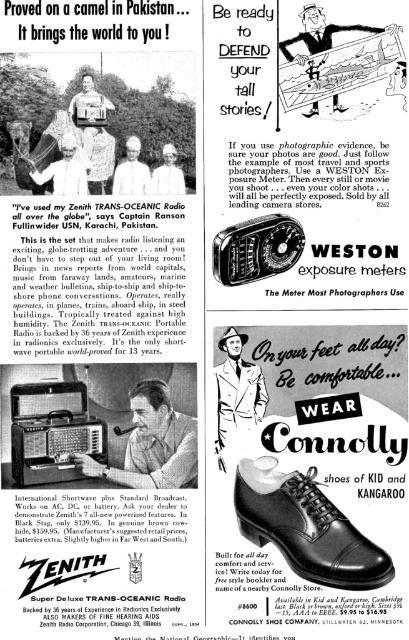
Does matte black radio at upper left have a greater width compared to white matte uniform at center?

Yes.

Who is positioned more to the right, matte black radio at upper left or white matte uniform at center?

white matte uniform at center is more to the right.

Does point (83, 188) come farther from viewer compared to point (175, 168)?

Yes, it is behind point (175, 168).

In order to click on matte black radio at upper left in this screenshot , I will do `click(65, 170)`.

Is the position of matte black suit at upper center less distant than that of white matte hat at center?

Yes.

Can you confirm if matte black suit at upper center is wider than white matte hat at center?

Indeed, matte black suit at upper center has a greater width compared to white matte hat at center.

Does point (355, 72) lie in front of point (132, 177)?

Yes, it is.

Locate an element on the screen. The width and height of the screenshot is (409, 640). matte black suit at upper center is located at coordinates (336, 61).

Is matte black radio at center in front of matte black radio at upper left?

No, it is behind matte black radio at upper left.

Who is taller, matte black radio at center or matte black radio at upper left?

matte black radio at center is taller.

Between point (191, 436) and point (44, 180), which one is positioned behind?

The point (191, 436) is more distant.

Locate an element on the screen. This screenshot has height=640, width=409. matte black radio at center is located at coordinates (152, 444).